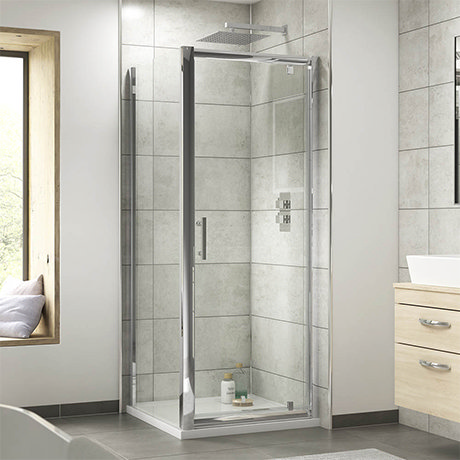
Locate an element on the screen. The height and width of the screenshot is (460, 460). handle is located at coordinates (204, 234).